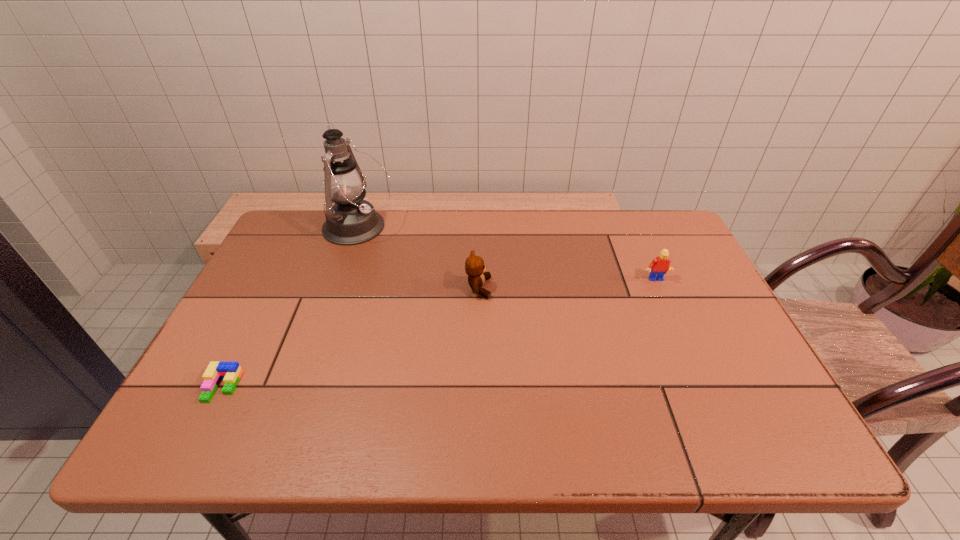
In the image, there is a desktop. Identify the location of blank space at the far right corner. This screenshot has height=540, width=960. (639, 223).

This screenshot has width=960, height=540. Identify the location of vacant space at the near right corner. (728, 444).

Find the location of a particular element. The image size is (960, 540). vacant space that is in between the nearest object and the oil lamp is located at coordinates (291, 307).

This screenshot has height=540, width=960. What are the coordinates of `vacant space in between the teddy bear and the nearer Lego` in the screenshot? It's located at (350, 338).

The width and height of the screenshot is (960, 540). I want to click on free area in between the shorter Lego and the third object from right to left, so click(291, 307).

The width and height of the screenshot is (960, 540). I want to click on vacant point located between the taller Lego and the tallest object, so click(x=507, y=254).

Image resolution: width=960 pixels, height=540 pixels. In order to click on vacant point located between the nearest object and the second object from left to right in this screenshot , I will do `click(291, 307)`.

At what (x,y) coordinates should I click in order to perform the action: click on unoccupied area between the second object from right to left and the shorter Lego. Please return your answer as a coordinate pair (x, y). Image resolution: width=960 pixels, height=540 pixels. Looking at the image, I should click on (350, 338).

The width and height of the screenshot is (960, 540). Identify the location of free space between the oil lamp and the rightmost object. (507, 254).

The height and width of the screenshot is (540, 960). I want to click on vacant region between the right Lego and the teddy bear, so click(x=566, y=284).